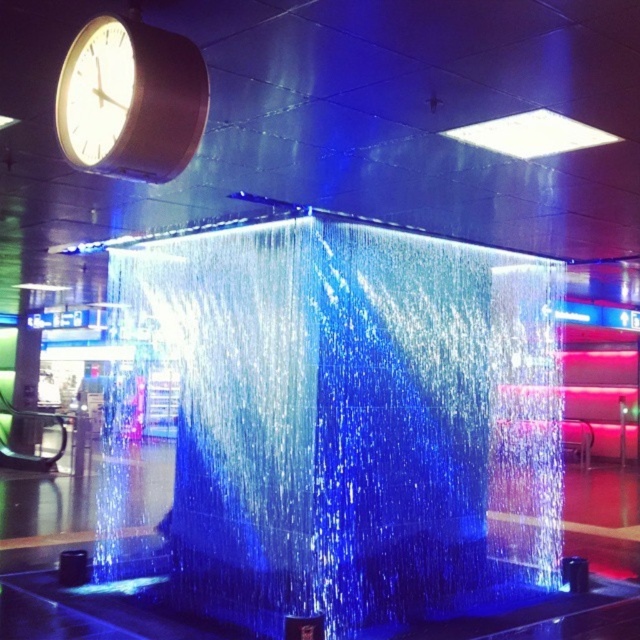
Question: Which object is farther from the camera taking this photo?

Choices:
 (A) translucent glass cube at center
 (B) white glossy square at upper center
 (C) matte black clock at upper left

Answer: (A)

Question: Which of the following is the farthest from the observer?

Choices:
 (A) (531, 136)
 (B) (184, 150)

Answer: (A)

Question: Can you confirm if translucent glass cube at center is positioned below white glossy square at upper center?

Choices:
 (A) no
 (B) yes

Answer: (B)

Question: Which of the following is the farthest from the observer?

Choices:
 (A) white glossy square at upper center
 (B) matte black clock at upper left
 (C) translucent glass cube at center

Answer: (C)

Question: Does translucent glass cube at center appear over matte black clock at upper left?

Choices:
 (A) yes
 (B) no

Answer: (B)

Question: Can you confirm if matte black clock at upper left is positioned to the left of white glossy square at upper center?

Choices:
 (A) no
 (B) yes

Answer: (B)